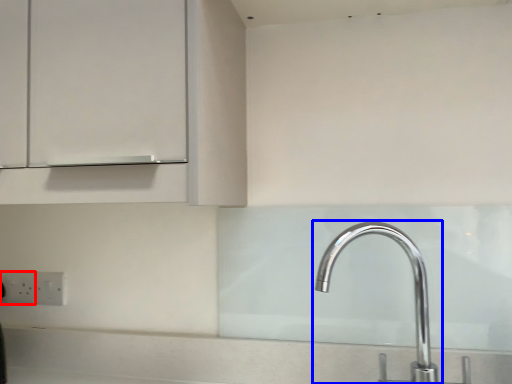
Question: Which object is further to the camera taking this photo, electric outlet (highlighted by a red box) or tap (highlighted by a blue box)?

Choices:
 (A) electric outlet
 (B) tap

Answer: (A)